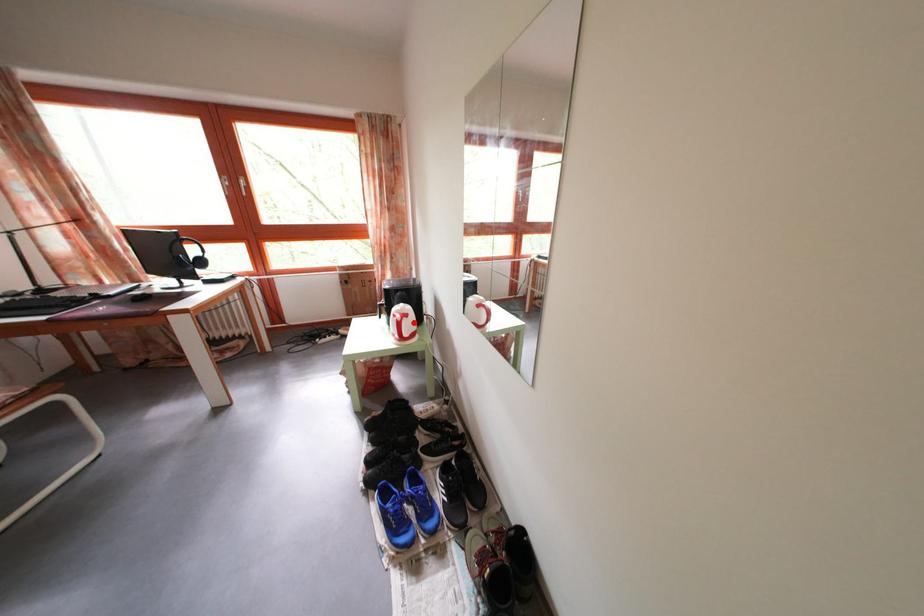
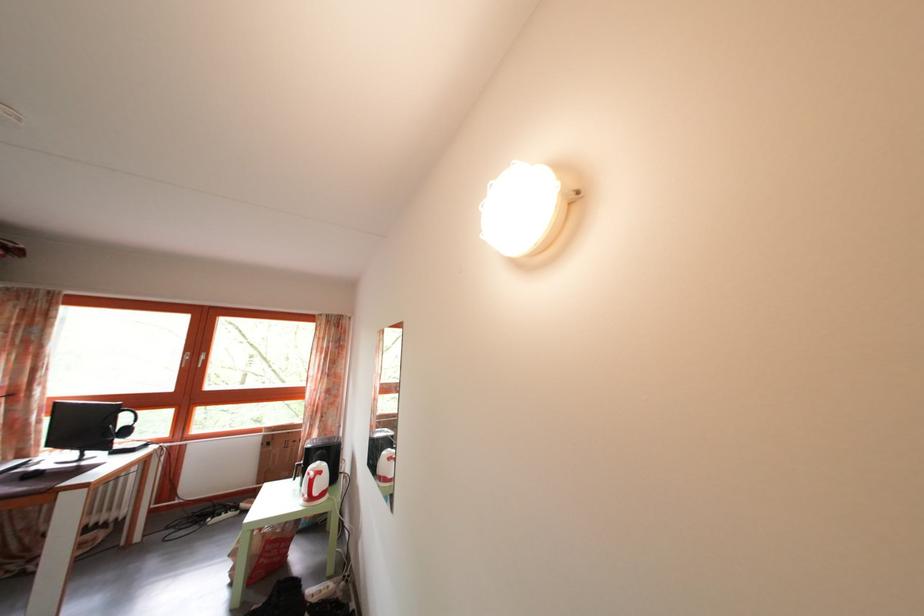
Locate, in the second image, the point that corresponds to the highlighted location in the first image.

(327, 480)